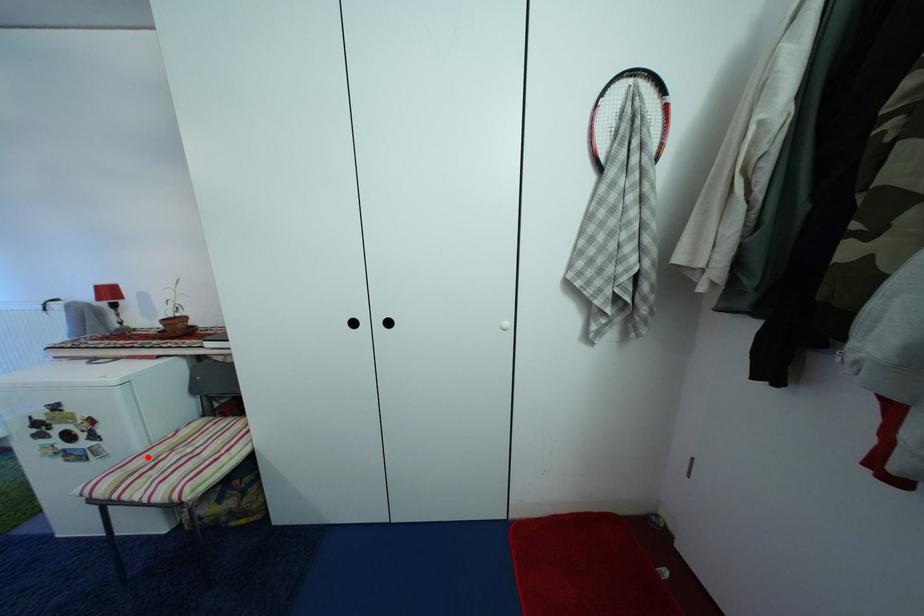
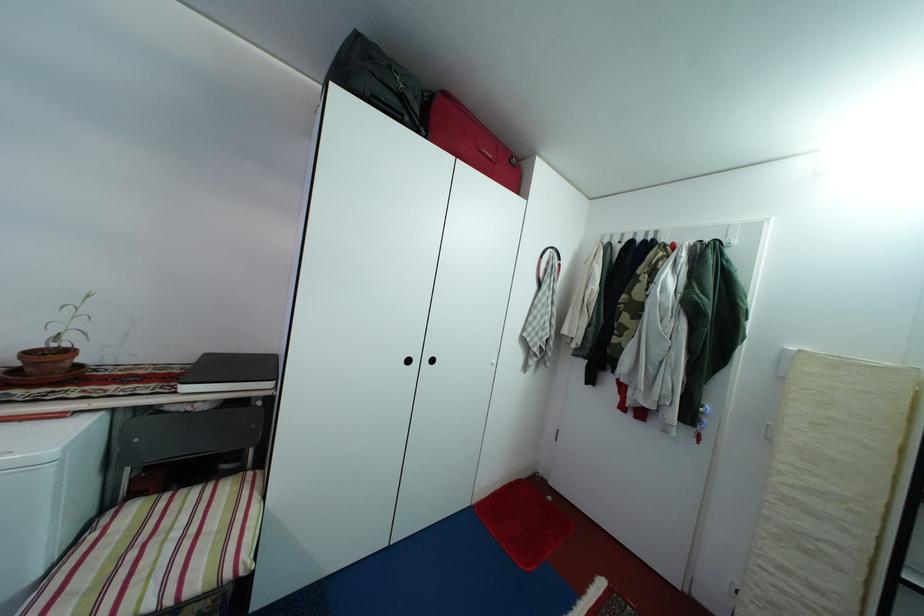
Question: I am providing you with two images of the same scene from different viewpoints. In image1, a red point is highlighted. Considering the same 3D point in image2, which of the following is correct?

Choices:
 (A) It is closer
 (B) It is farther

Answer: (A)